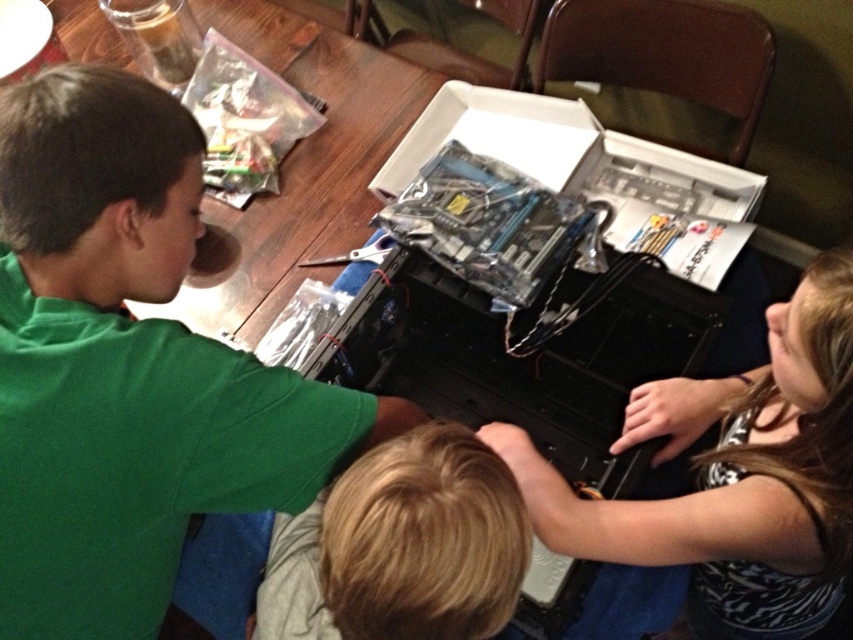
Question: Considering the relative positions of green matte shirt at upper left and blonde hair at center in the image provided, where is green matte shirt at upper left located with respect to blonde hair at center?

Choices:
 (A) left
 (B) right

Answer: (A)

Question: Is green matte shirt at upper left thinner than blonde hair at center?

Choices:
 (A) no
 (B) yes

Answer: (A)

Question: Does green matte shirt at upper left come behind blonde hair at center?

Choices:
 (A) no
 (B) yes

Answer: (B)